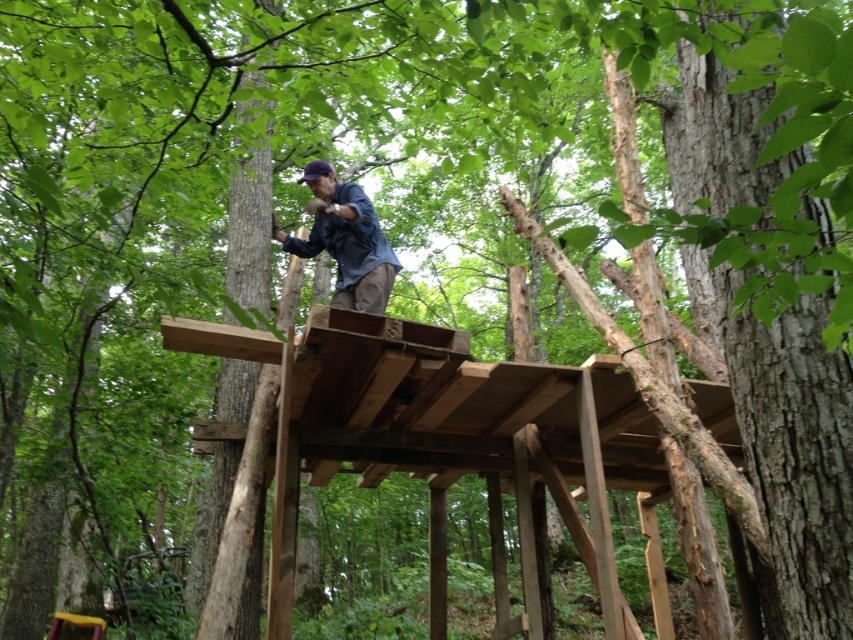
What do you see at coordinates (440, 420) in the screenshot? I see `natural wood platform at center` at bounding box center [440, 420].

You are a GUI agent. You are given a task and a screenshot of the screen. Output one action in this format:
    pyautogui.click(x=<x>, y=<y>)
    Task: Click on the natural wood platform at center
    Image resolution: width=853 pixels, height=640 pixels.
    Given the screenshot: What is the action you would take?
    click(x=440, y=420)